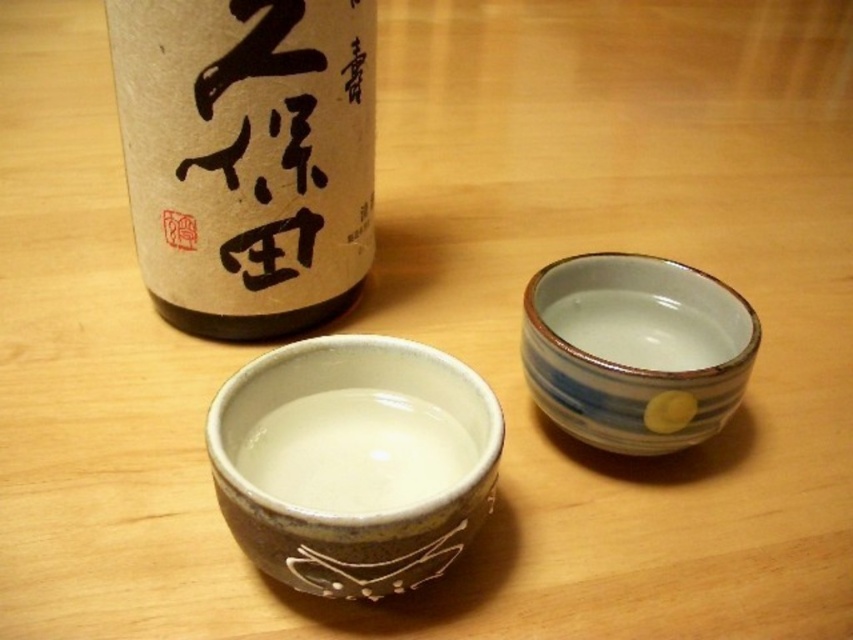
Who is shorter, matte ceramic bowl at center or white glossy bowl at center?

With less height is white glossy bowl at center.

Who is positioned more to the left, matte ceramic bowl at center or white glossy bowl at center?

matte ceramic bowl at center

What are the coordinates of `matte ceramic bowl at center` in the screenshot? It's located at (354, 461).

Between matte brown bottle at upper left and matte ceramic bowl at center, which one appears on the left side from the viewer's perspective?

Positioned to the left is matte brown bottle at upper left.

Which is behind, point (236, 208) or point (469, 508)?

The point (236, 208) is behind.

Where is `matte brown bottle at upper left`? matte brown bottle at upper left is located at coordinates (247, 156).

Between point (714, 404) and point (422, 436), which one is positioned behind?

Point (422, 436)

Who is shorter, blue striped ceramic cup at right or white glossy bowl at center?

With less height is white glossy bowl at center.

I want to click on blue striped ceramic cup at right, so click(635, 349).